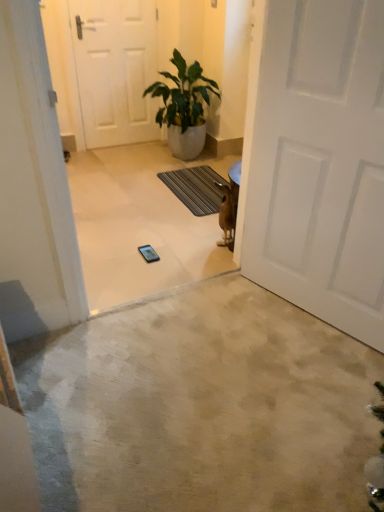
The width and height of the screenshot is (384, 512). What are the coordinates of `free space above beige carpet at center (from a real-world perspective)` in the screenshot? It's located at [214, 381].